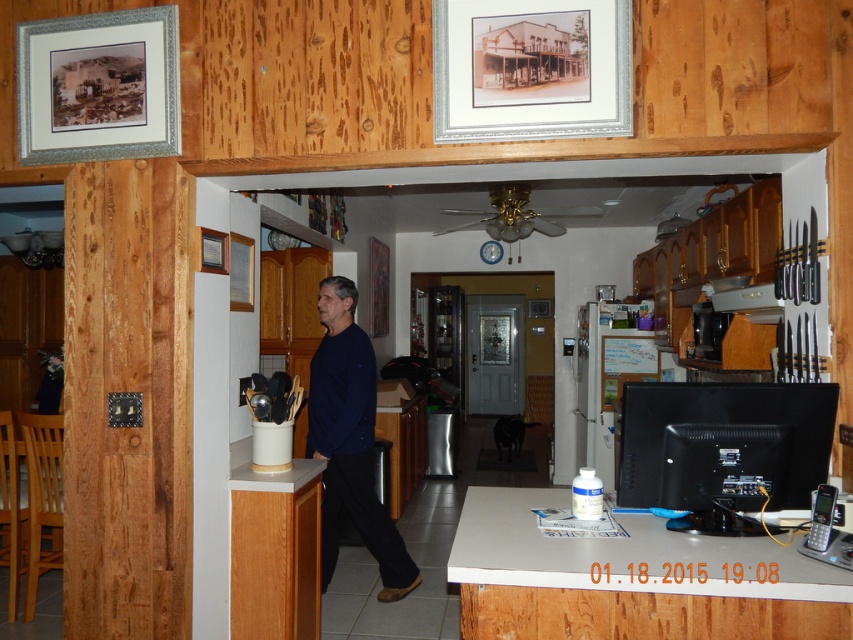
You are standing in the kitchen and want to take a photo of the dark blue sweater at center. If your camera is 10 feet away from the sweater, will you be able to capture it clearly?

The dark blue sweater at center and camera are 10.86 feet apart from each other. Since the camera is only 10 feet away, you are slightly too far to capture it clearly.

You are standing in the kitchen and want to grab the dark blue sweater at center. However, there is a matte black monitor at right in your way. Can you reach the sweater without moving the monitor?

The dark blue sweater at center is closer to the viewer than the matte black monitor at right, so you can reach it without moving the monitor since it is nearer.